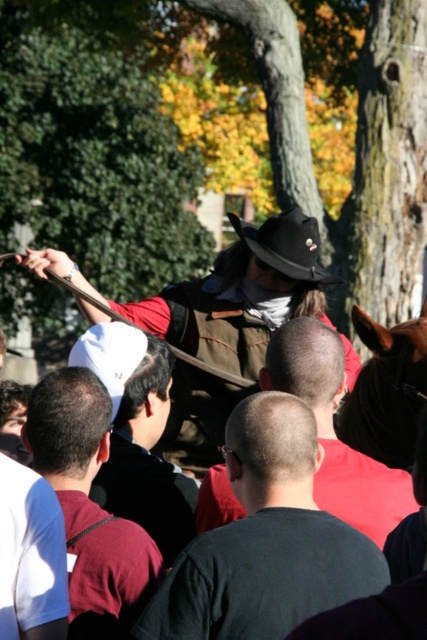
Does black matte shirt at center have a larger size compared to brown leather jacket at center?

Yes.

Is point (301, 522) closer to viewer compared to point (330, 388)?

That is True.

At what (x,y) coordinates should I click in order to perform the action: click on black matte shirt at center. Please return your answer as a coordinate pair (x, y). Looking at the image, I should click on (266, 540).

What do you see at coordinates (266, 540) in the screenshot? I see `black matte shirt at center` at bounding box center [266, 540].

Is black matte shirt at center to the left of maroon shirt at center from the viewer's perspective?

No, black matte shirt at center is not to the left of maroon shirt at center.

Where is `black matte shirt at center`? The width and height of the screenshot is (427, 640). black matte shirt at center is located at coordinates (266, 540).

The image size is (427, 640). Find the location of `black matte shirt at center`. black matte shirt at center is located at coordinates (266, 540).

Which is more to the right, maroon shirt at center or brown leather horse at right?

brown leather horse at right

Which is below, maroon shirt at center or brown leather horse at right?

maroon shirt at center is lower down.

The width and height of the screenshot is (427, 640). Describe the element at coordinates (90, 506) in the screenshot. I see `maroon shirt at center` at that location.

In order to click on maroon shirt at center in this screenshot , I will do click(90, 506).